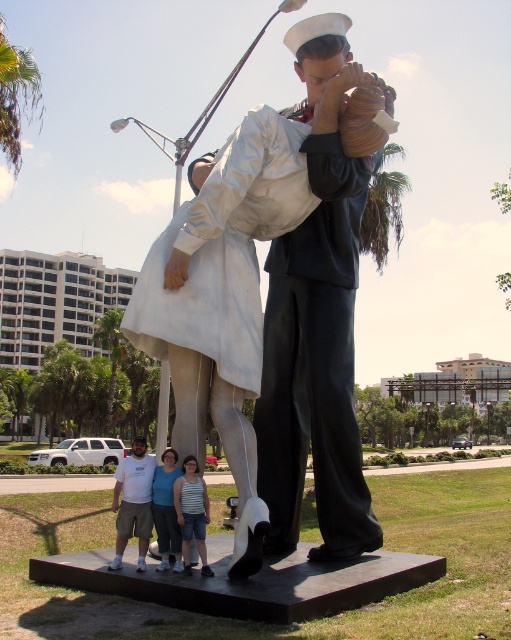
Question: Does white glossy statue at center have a lesser width compared to white cotton t-shirt at lower center?

Choices:
 (A) yes
 (B) no

Answer: (B)

Question: Which object appears farthest from the camera in this image?

Choices:
 (A) white cotton t-shirt at lower center
 (B) white matte shirt at lower center

Answer: (B)

Question: Which point is closer to the camera?

Choices:
 (A) white cotton t-shirt at lower center
 (B) white glossy statue at center

Answer: (B)

Question: Which point is closer to the camera taking this photo?

Choices:
 (A) (174, 259)
 (B) (142, 460)

Answer: (A)

Question: Can you confirm if white glossy statue at center is positioned to the right of white cotton t-shirt at lower center?

Choices:
 (A) no
 (B) yes

Answer: (B)

Question: Can you confirm if white glossy statue at center is positioned to the right of white cotton t-shirt at lower center?

Choices:
 (A) no
 (B) yes

Answer: (B)